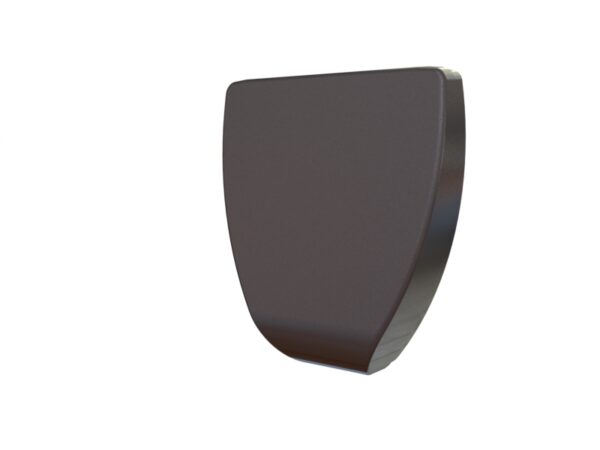
Find the location of a particular element. The width and height of the screenshot is (600, 450). light relecting on upper corner is located at coordinates (444, 68).